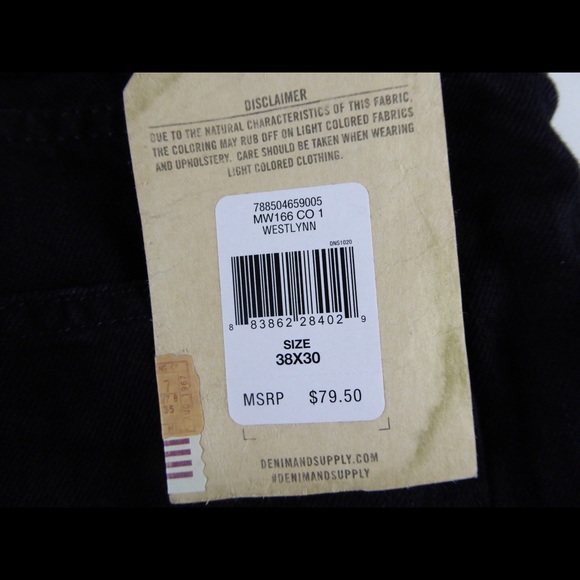
This screenshot has height=580, width=580. Identify the location of sticker. (313, 313).